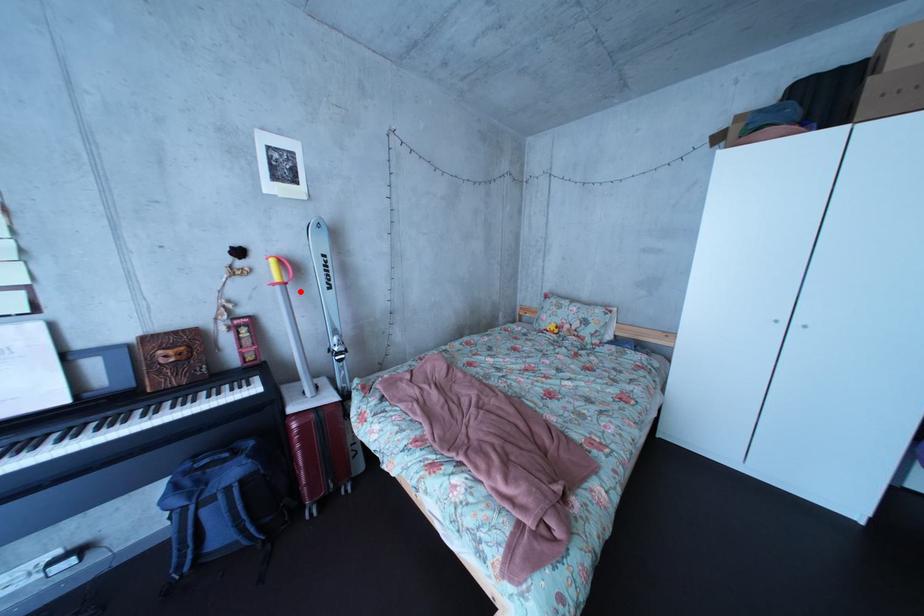
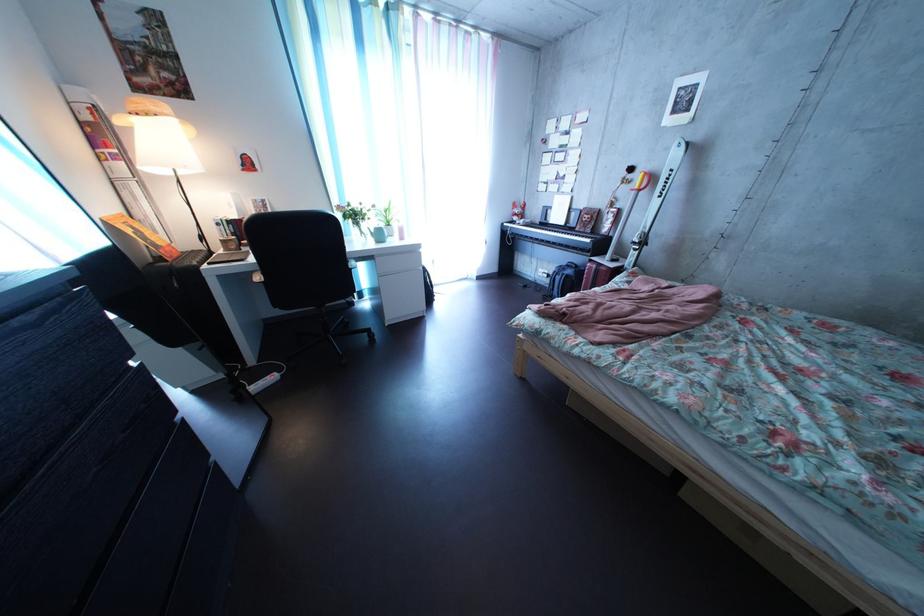
Question: I am providing you with two images of the same scene from different viewpoints. Image1 has a red point marked. In image2, the corresponding 3D location appears at what relative position? Reply with the corresponding letter.

Choices:
 (A) Closer
 (B) Farther

Answer: (A)